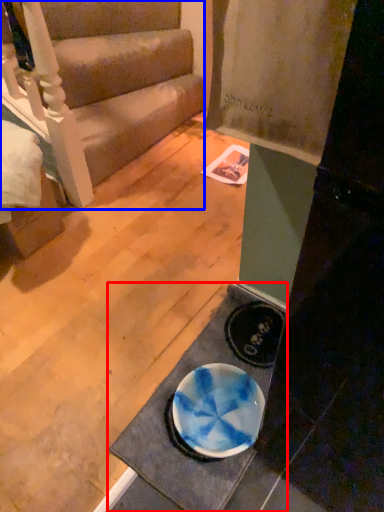
Question: Which point is further to the camera, doormat (highlighted by a red box) or studio couch (highlighted by a blue box)?

Choices:
 (A) doormat
 (B) studio couch

Answer: (B)